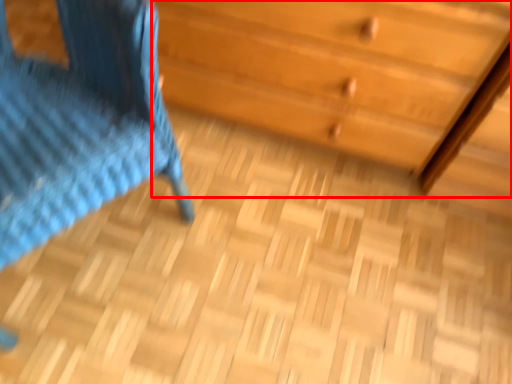
Question: From the image's perspective, what is the correct spatial positioning of chest of drawers (annotated by the red box) in reference to furniture?

Choices:
 (A) above
 (B) below

Answer: (A)